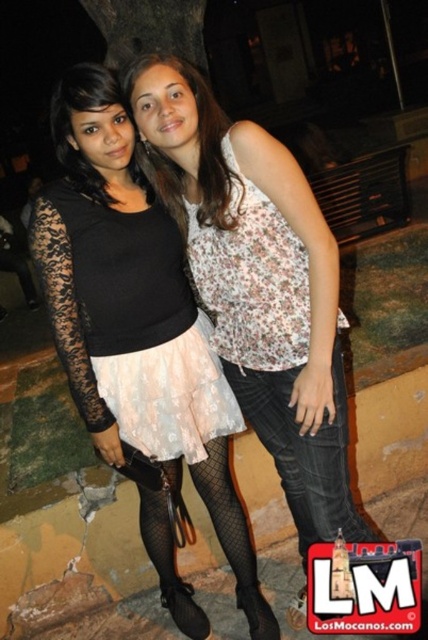
Question: Can you confirm if light pink lace skirt at center is smaller than matte floral tank top at center?

Choices:
 (A) no
 (B) yes

Answer: (A)

Question: Can you confirm if black lace skirt at center is smaller than green rough bark at upper center?

Choices:
 (A) yes
 (B) no

Answer: (A)

Question: Does matte floral tank top at center appear on the right side of green rough bark at upper center?

Choices:
 (A) no
 (B) yes

Answer: (B)

Question: Estimate the real-world distances between objects in this image. Which object is closer to the black lace skirt at center?

Choices:
 (A) jeans at center
 (B) light pink lace skirt at center
 (C) green rough bark at upper center
 (D) matte floral tank top at center

Answer: (B)

Question: Which point is farther from the camera taking this photo?

Choices:
 (A) (154, 200)
 (B) (333, 420)

Answer: (A)

Question: Estimate the real-world distances between objects in this image. Which object is closer to the jeans at center?

Choices:
 (A) black lace skirt at center
 (B) green rough bark at upper center
 (C) matte floral tank top at center
 (D) floral fabric top at center

Answer: (D)